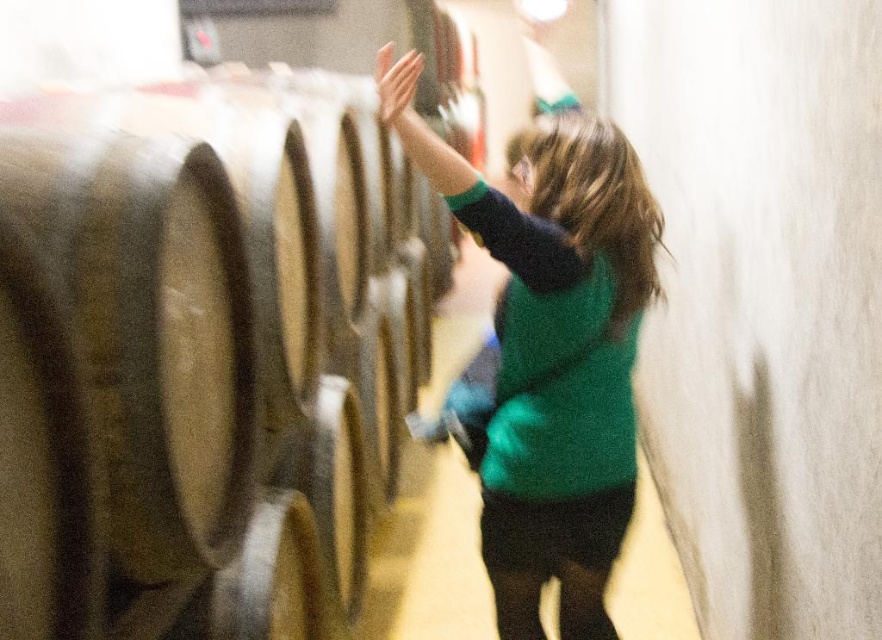
Question: Does smooth wood barrel at left have a smaller size compared to green knitted sweater at center?

Choices:
 (A) no
 (B) yes

Answer: (A)

Question: Does smooth wood barrel at left appear under green knitted sweater at center?

Choices:
 (A) no
 (B) yes

Answer: (A)

Question: In this image, where is smooth wood barrel at left located relative to green knitted sweater at center?

Choices:
 (A) below
 (B) above

Answer: (B)

Question: Among these points, which one is nearest to the camera?

Choices:
 (A) (567, 602)
 (B) (91, 304)

Answer: (B)